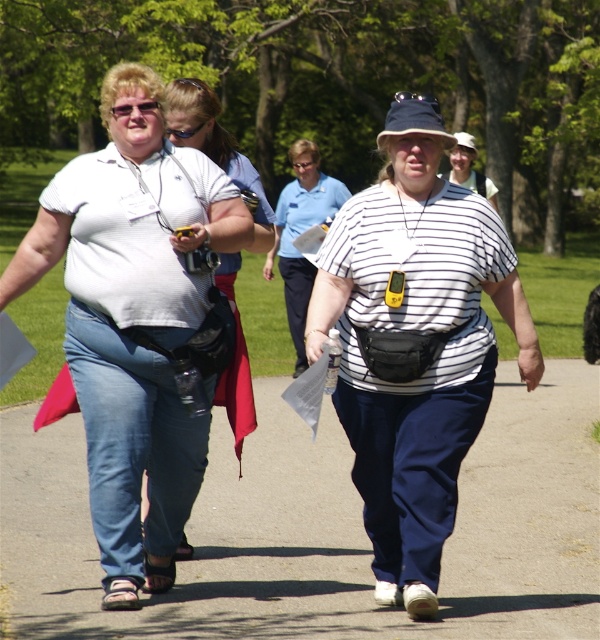
You are a photographer trying to capture a clear shot of the matte white shirt at left and the clear plastic goggles at upper center. Which object should you focus on first to ensure it appears sharp in the photo?

You should focus on the matte white shirt at left first because it is closer to the viewer than the clear plastic goggles at upper center, so focusing on the closer object ensures it will be sharp.

You are a photographer trying to capture a clear shot of the navy blue fabric baseball hat at center without the white matte shirt at upper left blocking it. Based on their positions, is this possible?

The navy blue fabric baseball hat at center is behind the white matte shirt at upper left, so it is blocked by the shirt and cannot be captured clearly without moving the shirt out of the way.

You are a drone operator trying to capture a photo of the clear plastic goggles at upper center and the navy blue fabric baseball hat at center. Your drone can only focus on objects within a 10 feet range. Can you capture both objects in one shot without moving the drone?

The navy blue fabric baseball hat at center is 11.56 feet from the clear plastic goggles at upper center. Since the distance exceeds the 10 feet range, the drone cannot capture both objects in one shot without moving.